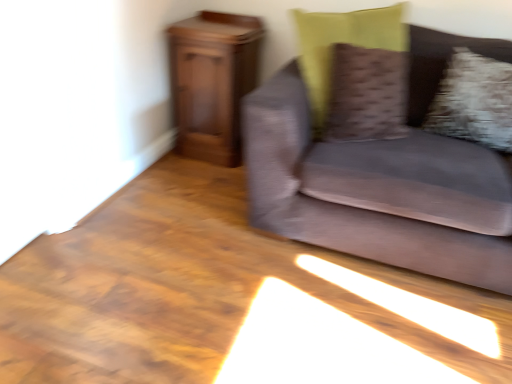
Question: Can you confirm if textured brown pillow at upper right, the 2th pillow when ordered from right to left, is positioned to the right of wooden cabinet at left?

Choices:
 (A) no
 (B) yes

Answer: (B)

Question: Is textured brown pillow at upper right, which appears as the first pillow when viewed from the left, smaller than wooden cabinet at left?

Choices:
 (A) no
 (B) yes

Answer: (B)

Question: Is textured brown pillow at upper right, which appears as the first pillow when viewed from the left, located outside wooden cabinet at left?

Choices:
 (A) yes
 (B) no

Answer: (A)

Question: From the image's perspective, does textured brown pillow at upper right, the 2th pillow when ordered from right to left, appear lower than wooden cabinet at left?

Choices:
 (A) yes
 (B) no

Answer: (A)

Question: Considering the relative sizes of textured brown pillow at upper right, the 2th pillow when ordered from right to left, and wooden cabinet at left in the image provided, is textured brown pillow at upper right, the 2th pillow when ordered from right to left, bigger than wooden cabinet at left?

Choices:
 (A) yes
 (B) no

Answer: (B)

Question: From a real-world perspective, is textured brown pillow at upper right, which appears as the first pillow when viewed from the left, physically below wooden cabinet at left?

Choices:
 (A) no
 (B) yes

Answer: (A)

Question: Considering the relative positions of velvet gray couch at right and fluffy white pillow at right, the 1th pillow viewed from the right, in the image provided, is velvet gray couch at right to the left of fluffy white pillow at right, the 1th pillow viewed from the right, from the viewer's perspective?

Choices:
 (A) yes
 (B) no

Answer: (A)

Question: From the image's perspective, does velvet gray couch at right appear lower than fluffy white pillow at right, the 1th pillow viewed from the right?

Choices:
 (A) no
 (B) yes

Answer: (B)

Question: From the image's perspective, is velvet gray couch at right located above fluffy white pillow at right, arranged as the 2th pillow when viewed from the left?

Choices:
 (A) no
 (B) yes

Answer: (A)

Question: Can you confirm if velvet gray couch at right is positioned to the right of fluffy white pillow at right, arranged as the 2th pillow when viewed from the left?

Choices:
 (A) no
 (B) yes

Answer: (A)

Question: Would you consider velvet gray couch at right to be distant from fluffy white pillow at right, arranged as the 2th pillow when viewed from the left?

Choices:
 (A) yes
 (B) no

Answer: (B)

Question: Is velvet gray couch at right bigger than fluffy white pillow at right, the 1th pillow viewed from the right?

Choices:
 (A) no
 (B) yes

Answer: (B)

Question: Does wooden cabinet at left lie in front of fluffy white pillow at right, arranged as the 2th pillow when viewed from the left?

Choices:
 (A) yes
 (B) no

Answer: (B)